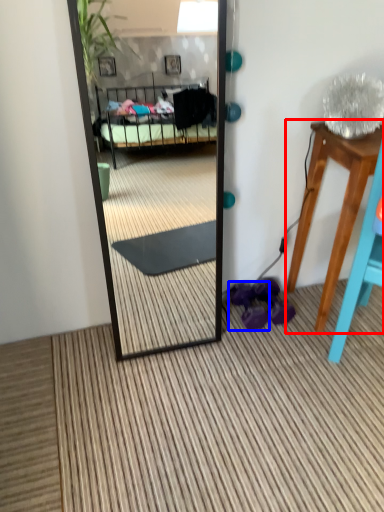
Question: Which object appears farthest to the camera in this image, table (highlighted by a red box) or shoe (highlighted by a blue box)?

Choices:
 (A) table
 (B) shoe

Answer: (B)